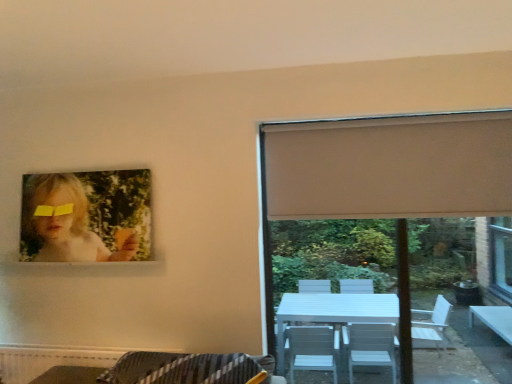
Find the location of `free spot below matte paper portrait at upper left (from a real-world perspective)`. free spot below matte paper portrait at upper left (from a real-world perspective) is located at coordinates (85, 263).